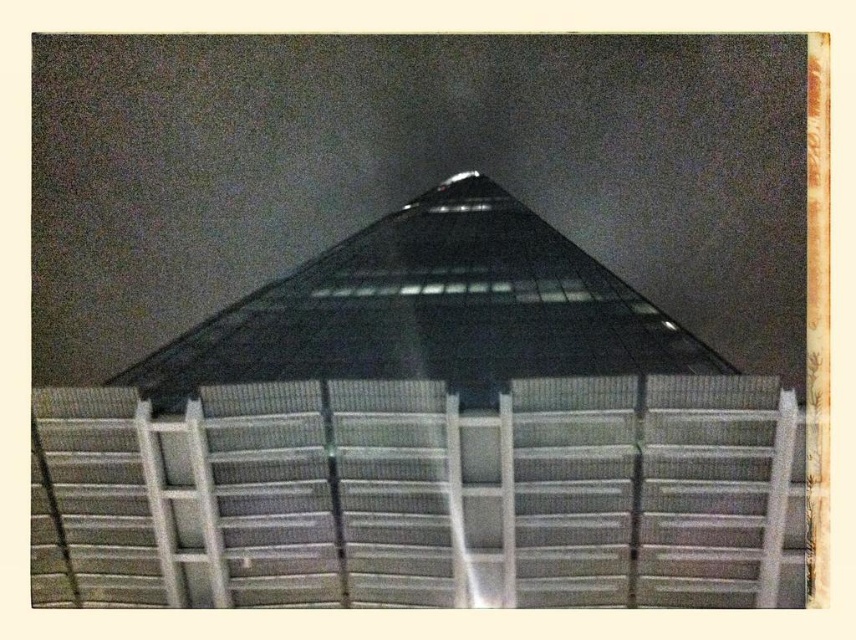
Looking at this image, how distant is metallic grid at center from transparent glass roof at center?

metallic grid at center is 4.24 meters from transparent glass roof at center.

Who is more distant from viewer, (x=207, y=516) or (x=176, y=406)?

The point (x=176, y=406) is more distant.

At what (x,y) coordinates should I click in order to perform the action: click on metallic grid at center. Please return your answer as a coordinate pair (x, y). Looking at the image, I should click on (421, 497).